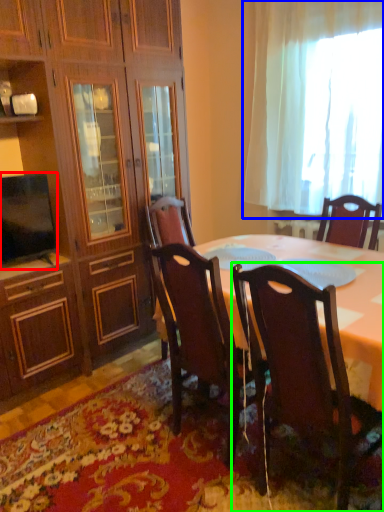
Question: Based on their relative distances, which object is farther from television (highlighted by a red box)? Choose from curtain (highlighted by a blue box) and chair (highlighted by a green box).

Choices:
 (A) curtain
 (B) chair

Answer: (A)